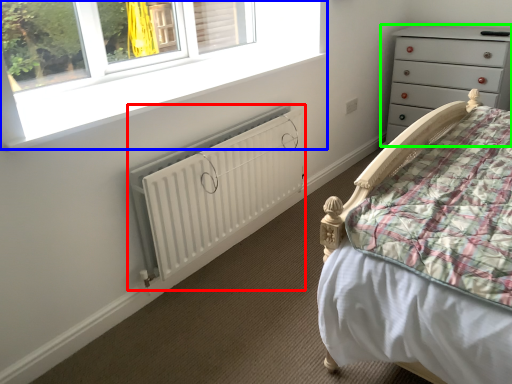
Question: Considering the real-world distances, which object is farthest from radiator (highlighted by a red box)? window (highlighted by a blue box) or chest of drawers (highlighted by a green box)?

Choices:
 (A) window
 (B) chest of drawers

Answer: (B)